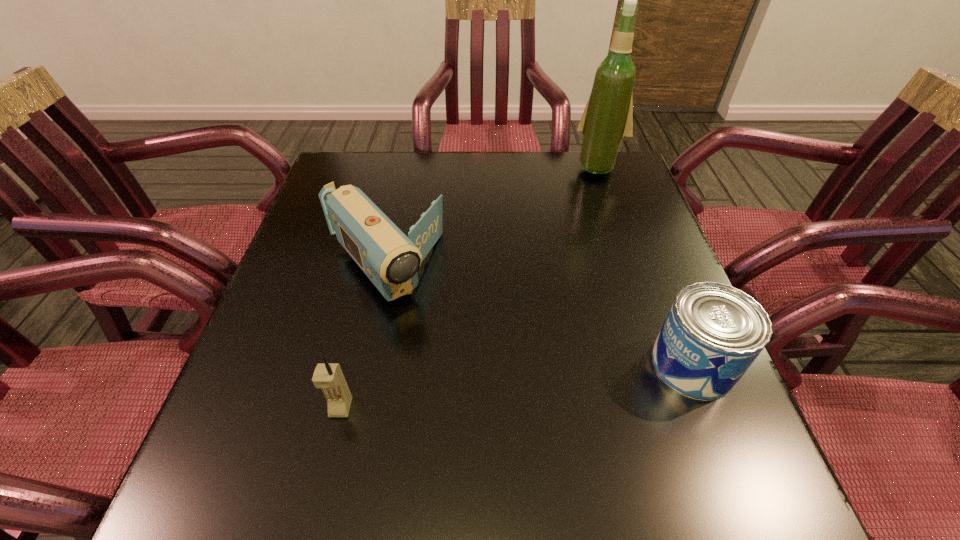
Where is `object that is the third closest to the wine bottle`? This screenshot has height=540, width=960. object that is the third closest to the wine bottle is located at coordinates (329, 377).

Select which object appears as the second closest to the tallest object. Please provide its 2D coordinates. Your answer should be formatted as a tuple, i.e. [(x, y)], where the tuple contains the x and y coordinates of a point satisfying the conditions above.

[(713, 332)]

Locate an element on the screen. vacant space that satisfies the following two spatial constraints: 1. on the front side of the farthest object; 2. on the front label of the shortest object is located at coordinates (667, 364).